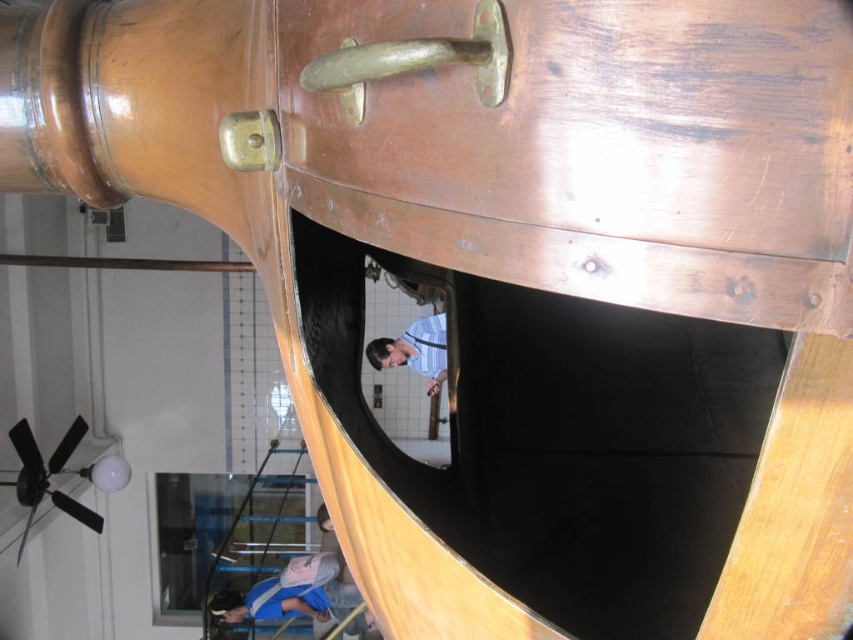
Question: Estimate the real-world distances between objects in this image. Which object is farther from the matte blue shirt at center?

Choices:
 (A) brass/bronze metallic door handle at upper center
 (B) brass/bronze handle at upper center

Answer: (B)

Question: Does matte blue shirt at center lie behind brass/bronze metallic door handle at upper center?

Choices:
 (A) no
 (B) yes

Answer: (B)

Question: Considering the relative positions of matte blue shirt at center and brass/bronze metallic door handle at upper center in the image provided, where is matte blue shirt at center located with respect to brass/bronze metallic door handle at upper center?

Choices:
 (A) below
 (B) above

Answer: (A)

Question: Does brass/bronze handle at upper center have a smaller size compared to brass/bronze metallic door handle at upper center?

Choices:
 (A) yes
 (B) no

Answer: (B)

Question: Considering the real-world distances, which object is closest to the brass/bronze handle at upper center?

Choices:
 (A) matte blue shirt at center
 (B) brass/bronze metallic door handle at upper center

Answer: (B)

Question: Which object appears farthest from the camera in this image?

Choices:
 (A) matte blue shirt at center
 (B) brass/bronze handle at upper center

Answer: (A)